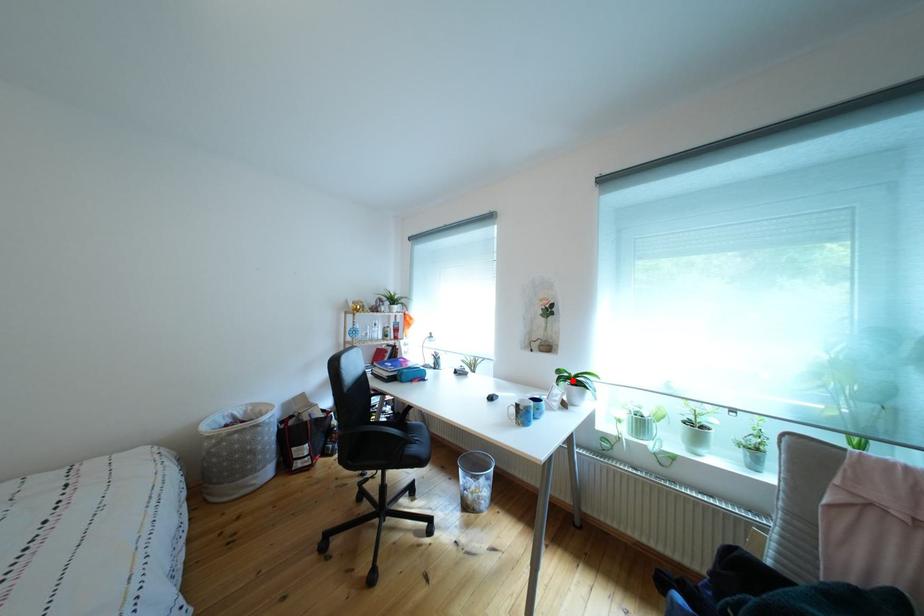
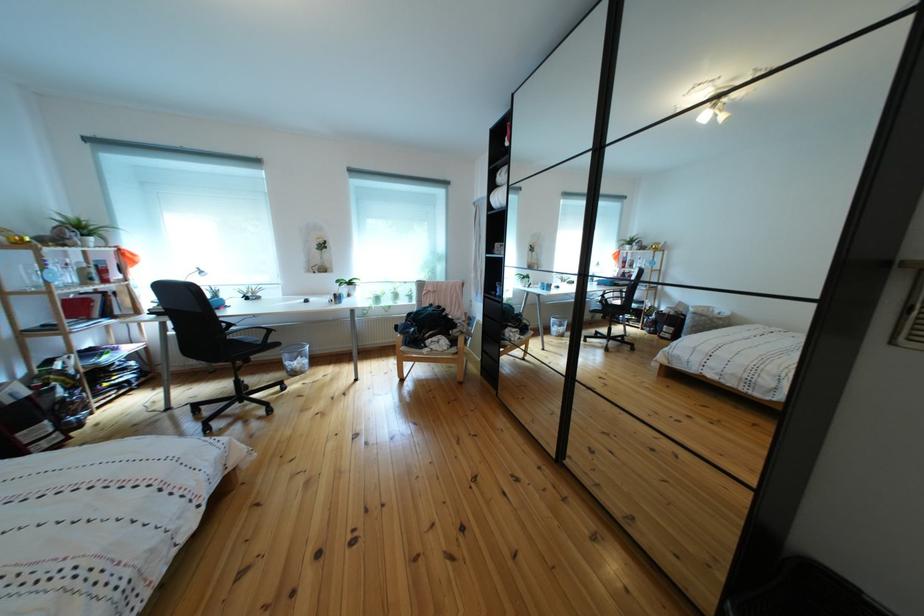
Question: A red point is marked in image1. In image2, is the corresponding 3D point closer to the camera or farther? Reply with the corresponding letter.

Choices:
 (A) The corresponding 3D point is closer.
 (B) The corresponding 3D point is farther.

Answer: (A)